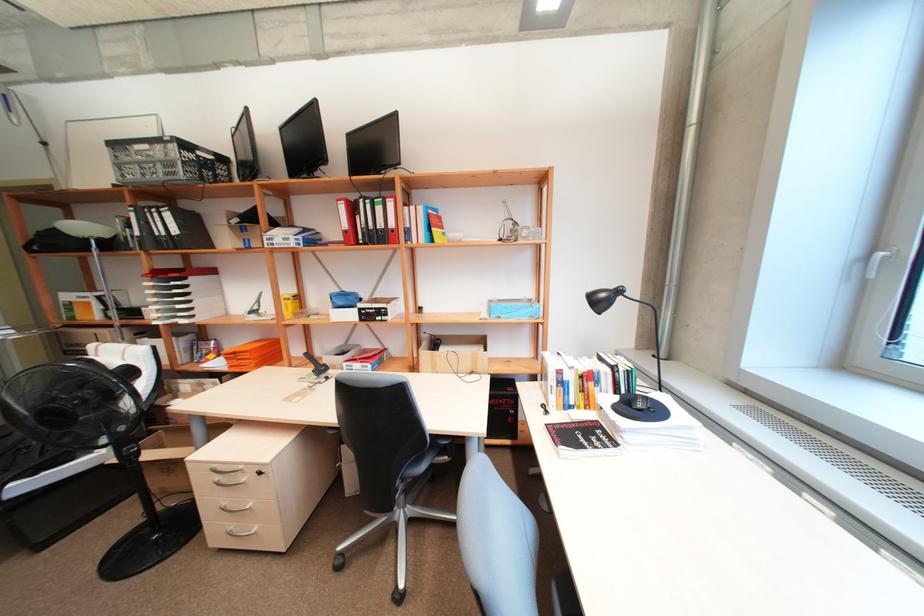
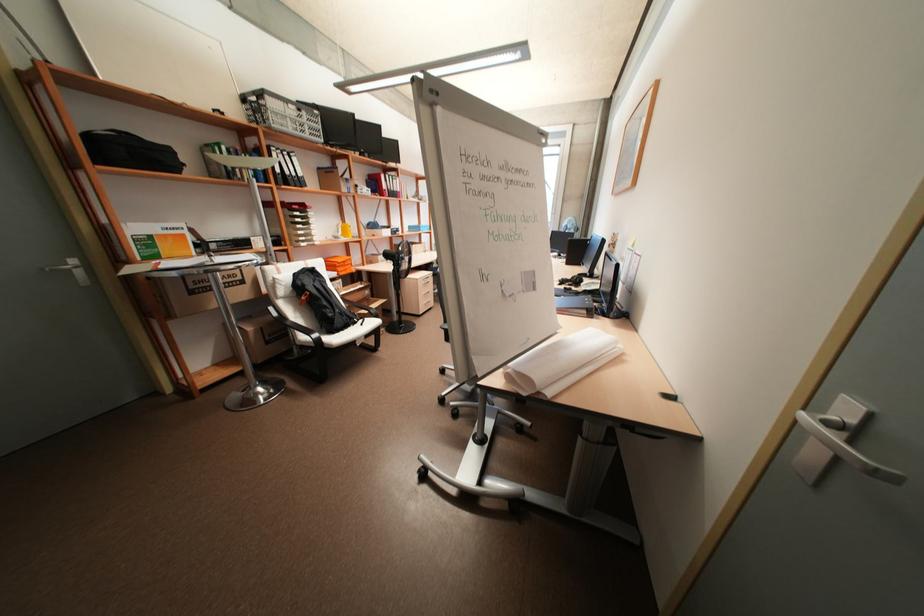
Where in the second image is the point corresponding to [162,215] from the first image?

(293, 158)